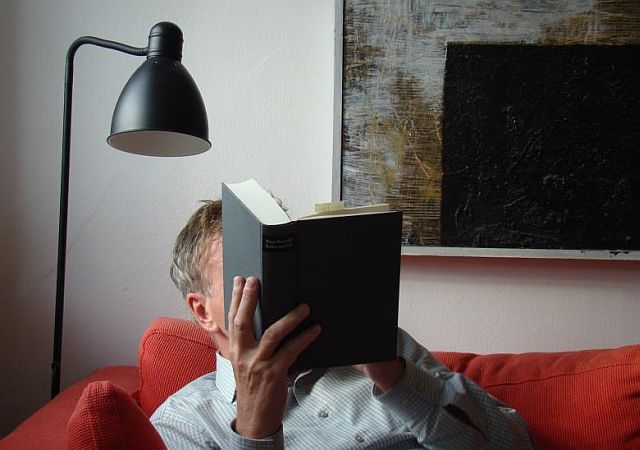
This screenshot has height=450, width=640. Identify the location of painting. (520, 88).